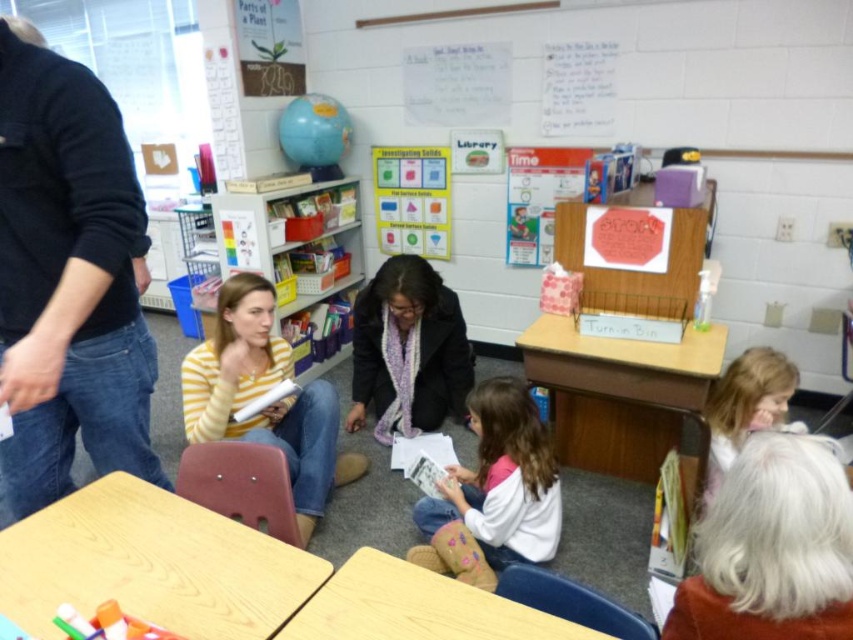
You are a student in the classroom looking at the black cotton shirt at upper left and the white soft sweater at lower center. Which one is positioned more to the left side of the classroom?

The black cotton shirt at upper left is positioned more to the left side of the classroom than the white soft sweater at lower center.

You are a student standing in the classroom and want to hand a note to both the person wearing the black cotton shirt at upper left and the person wearing the white soft sweater at lower center. Which person will you approach first to give your note?

You should approach the black cotton shirt at upper left first because it is closer to you than the white soft sweater at lower center.